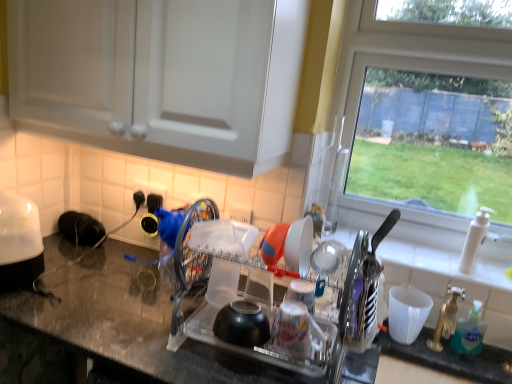
Question: Considering the relative positions of blue translucent soap dispenser at right and white plastic cup at right, which appears as the second tableware when viewed from the front, in the image provided, is blue translucent soap dispenser at right to the left or to the right of white plastic cup at right, which appears as the second tableware when viewed from the front,?

Choices:
 (A) left
 (B) right

Answer: (B)

Question: Considering their positions, is blue translucent soap dispenser at right located in front of or behind white plastic cup at right, which appears as the second tableware when viewed from the front?

Choices:
 (A) behind
 (B) front

Answer: (B)

Question: Estimate the real-world distances between objects in this image. Which object is closer to the transparent plastic dish rack at center?

Choices:
 (A) transparent glass window at upper right
 (B) white glossy toaster at left
 (C) orange plastic bowl at center, arranged as the second tableware when ordered from the bottom
 (D) blue translucent soap dispenser at right
 (E) granite black countertop at center

Answer: (E)

Question: Considering the real-world distances, which object is farthest from the white glossy cabinet at upper center?

Choices:
 (A) white glossy toaster at left
 (B) blue translucent soap dispenser at right
 (C) white plastic faucet at right
 (D) granite black countertop at center
 (E) orange plastic bowl at center, which appears as the 2th tableware when viewed from the back

Answer: (B)